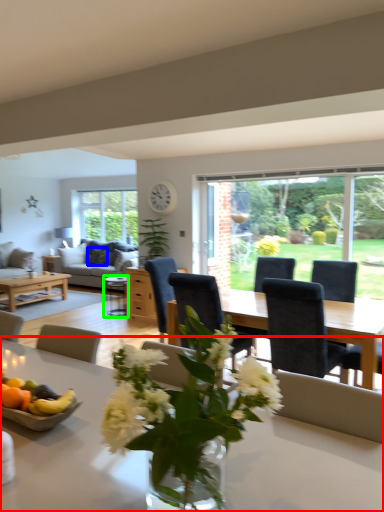
Question: Which object is the farthest from table (highlighted by a red box)? Choose among these: pillow (highlighted by a blue box) or coffee table (highlighted by a green box).

Choices:
 (A) pillow
 (B) coffee table

Answer: (A)